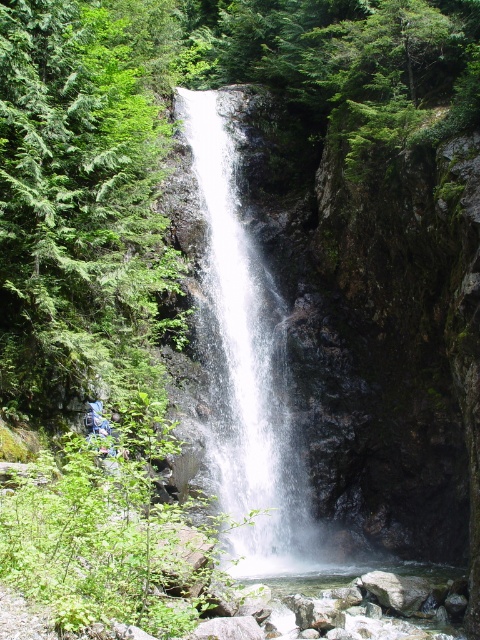
Is green textured tree at upper left positioned at the back of white frothy water at center?

That is False.

Measure the distance between green textured tree at upper left and camera.

A distance of 13.79 meters exists between green textured tree at upper left and camera.

Identify the location of green textured tree at upper left. Image resolution: width=480 pixels, height=640 pixels. (81, 196).